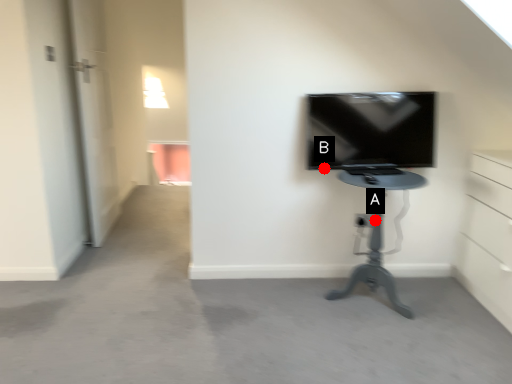
Question: Two points are circled on the image, labeled by A and B beside each circle. Which point is closer to the camera taking this photo?

Choices:
 (A) A is closer
 (B) B is closer

Answer: (A)